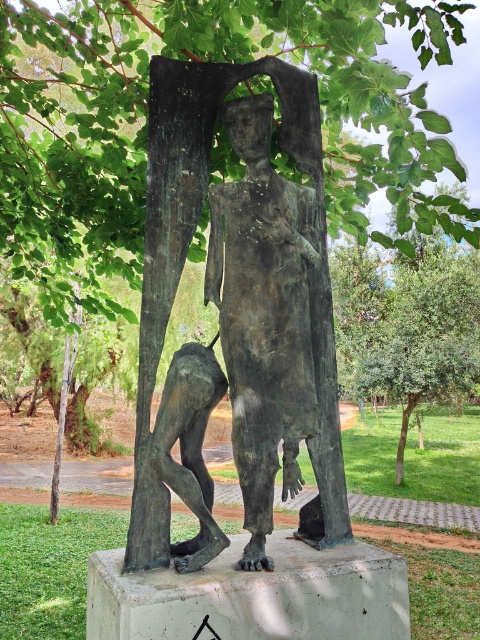
You are standing at the center of a park and want to locate the bronze statue at center. According to the coordinates provided, where should you look relative to your current position?

The bronze statue at center is located at coordinates point (191, 230), which is slightly to the lower right of your current position.

You are an art student visiting the park and want to take a photo of both the bronze statue at center and the bronze sculpture at lower left. Which one should you focus on first if you want to capture their full height in a single frame without moving the camera?

The bronze statue at center is much taller than the bronze sculpture at lower left, so you should focus on capturing the bronze statue at center first to ensure its full height fits in the frame before adjusting for the smaller bronze sculpture at lower left.

You are an art student analyzing the sculpture arrangement in the park. You observe the bronze statue at center and the bronze sculpture at lower left. Which one has a greater width?

The bronze statue at center has a greater width than the bronze sculpture at lower left.